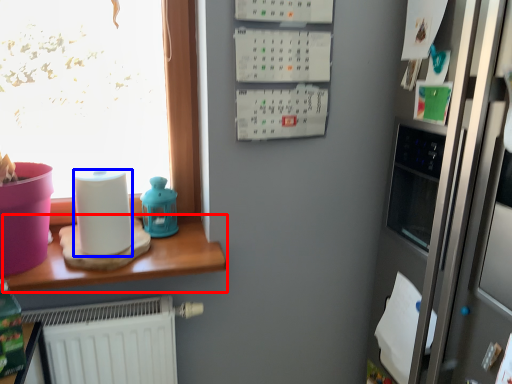
Question: Which of the following is the closest to the observer, table (highlighted by a red box) or paper towel (highlighted by a blue box)?

Choices:
 (A) table
 (B) paper towel

Answer: (A)